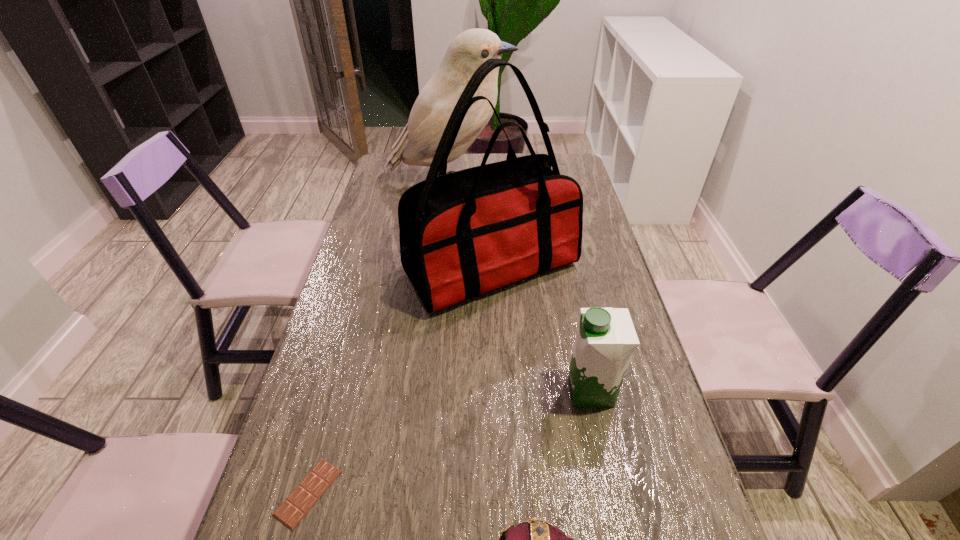
You are a GUI agent. You are given a task and a screenshot of the screen. Output one action in this format:
    pyautogui.click(x=<x>, y=<y>)
    Task: Click on the blank space at the far left corner
    
    Given the screenshot: What is the action you would take?
    pyautogui.click(x=382, y=162)

The width and height of the screenshot is (960, 540). In the image, there is a desktop. In order to click on vacant space at the far right corner in this screenshot , I will do `click(564, 175)`.

At what (x,y) coordinates should I click in order to perform the action: click on free space between the duffel bag and the chocolate bar. Please return your answer as a coordinate pair (x, y). The width and height of the screenshot is (960, 540). Looking at the image, I should click on (399, 381).

At what (x,y) coordinates should I click in order to perform the action: click on empty space between the second farthest object and the third nearest object. Please return your answer as a coordinate pair (x, y). The height and width of the screenshot is (540, 960). Looking at the image, I should click on (541, 330).

At what (x,y) coordinates should I click in order to perform the action: click on free spot between the third farthest object and the farthest object. Please return your answer as a coordinate pair (x, y). Image resolution: width=960 pixels, height=540 pixels. Looking at the image, I should click on (520, 287).

You are a GUI agent. You are given a task and a screenshot of the screen. Output one action in this format:
    pyautogui.click(x=<x>, y=<y>)
    Task: Click on the vacant space that is in between the farthest object and the soya milk
    Image resolution: width=960 pixels, height=540 pixels.
    Given the screenshot: What is the action you would take?
    pyautogui.click(x=520, y=287)

Locate an element on the screen. The height and width of the screenshot is (540, 960). object that is the second nearest to the farthest object is located at coordinates (606, 338).

I want to click on the fourth closest object to the soya milk, so point(417,144).